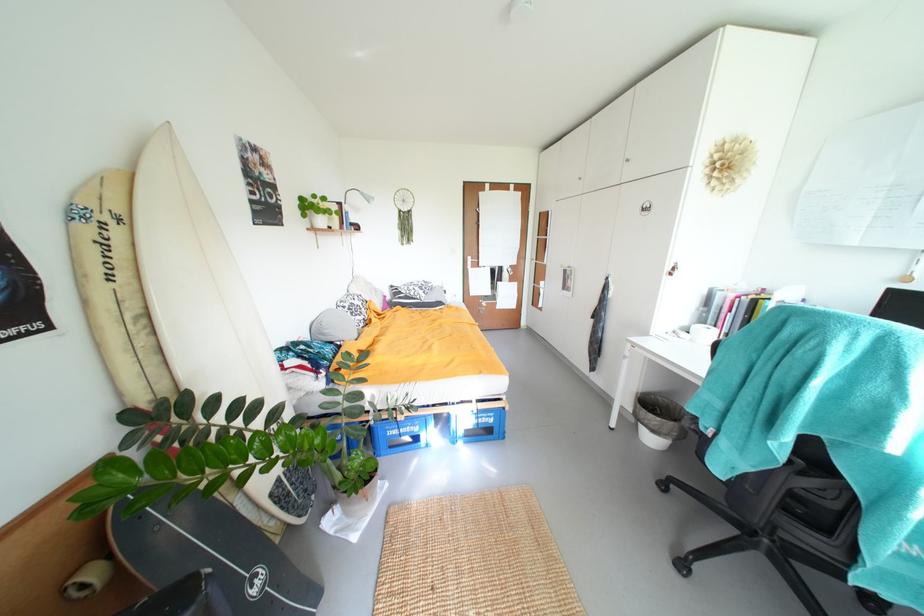
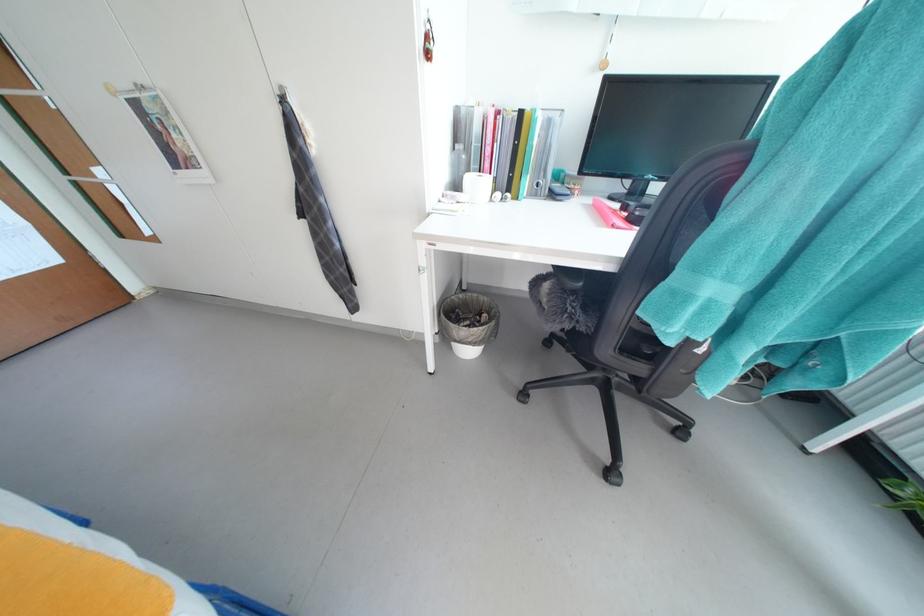
Locate, in the second image, the point that corresponds to pixel 735 336 in the first image.

(503, 182)